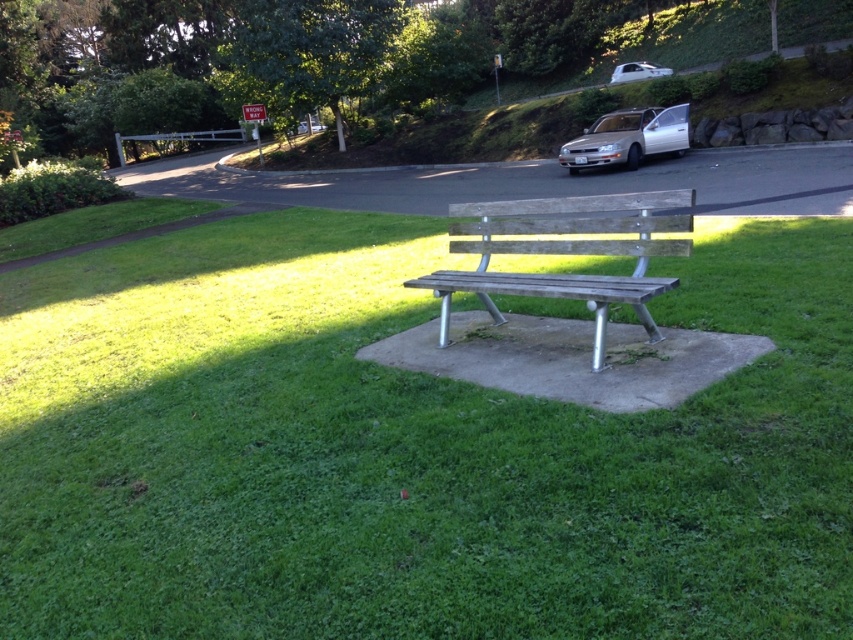
Does weathered wood bench at center have a greater height compared to white glossy car at upper center?

No.

Can you confirm if weathered wood bench at center is positioned below white glossy car at upper center?

Correct, weathered wood bench at center is located below white glossy car at upper center.

Which is in front, point (613, 220) or point (656, 65)?

Point (613, 220) is more forward.

Image resolution: width=853 pixels, height=640 pixels. In order to click on weathered wood bench at center in this screenshot , I will do `click(566, 253)`.

Between point (608, 156) and point (624, 72), which one is positioned behind?

Point (624, 72)

Can you confirm if silver metallic sedan at upper right is positioned to the right of white glossy car at upper center?

Incorrect, silver metallic sedan at upper right is not on the right side of white glossy car at upper center.

Is point (660, 116) less distant than point (622, 76)?

That is True.

In order to click on silver metallic sedan at upper right in this screenshot , I will do `click(627, 138)`.

Who is more distant from viewer, (323,330) or (627,196)?

The point (323,330) is behind.

Who is positioned more to the left, green grassy at center or weathered wood bench at center?

green grassy at center

Who is more forward, (x=467, y=579) or (x=547, y=282)?

Point (x=467, y=579) is in front.

Find the location of a particular element. This screenshot has height=640, width=853. green grassy at center is located at coordinates (408, 451).